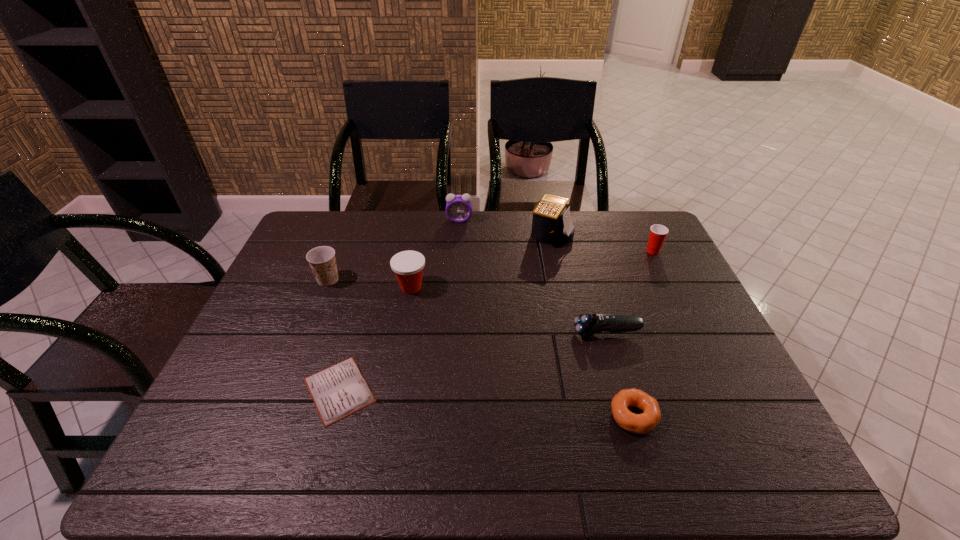
The image size is (960, 540). I want to click on calculator, so click(x=551, y=224).

Find the location of a particular element. The image size is (960, 540). alarm clock is located at coordinates (458, 207).

Locate an element on the screen. The image size is (960, 540). the second Dixie cup from left to right is located at coordinates (408, 266).

At what (x,y) coordinates should I click in order to perform the action: click on the leftmost Dixie cup. Please return your answer as a coordinate pair (x, y). The image size is (960, 540). Looking at the image, I should click on (322, 261).

At what (x,y) coordinates should I click in order to perform the action: click on the rightmost object. Please return your answer as a coordinate pair (x, y). This screenshot has width=960, height=540. Looking at the image, I should click on (658, 232).

Find the location of a particular element. The width and height of the screenshot is (960, 540). the farthest Dixie cup is located at coordinates (658, 232).

The height and width of the screenshot is (540, 960). In order to click on the sixth tallest object in this screenshot , I will do `click(587, 325)`.

The width and height of the screenshot is (960, 540). I want to click on electric shaver, so click(x=587, y=325).

You are a GUI agent. You are given a task and a screenshot of the screen. Output one action in this format:
    pyautogui.click(x=<x>, y=<y>)
    Task: Click on the seventh tallest object
    This screenshot has width=960, height=540.
    Given the screenshot: What is the action you would take?
    pyautogui.click(x=643, y=423)

This screenshot has height=540, width=960. I want to click on diary, so click(x=338, y=391).